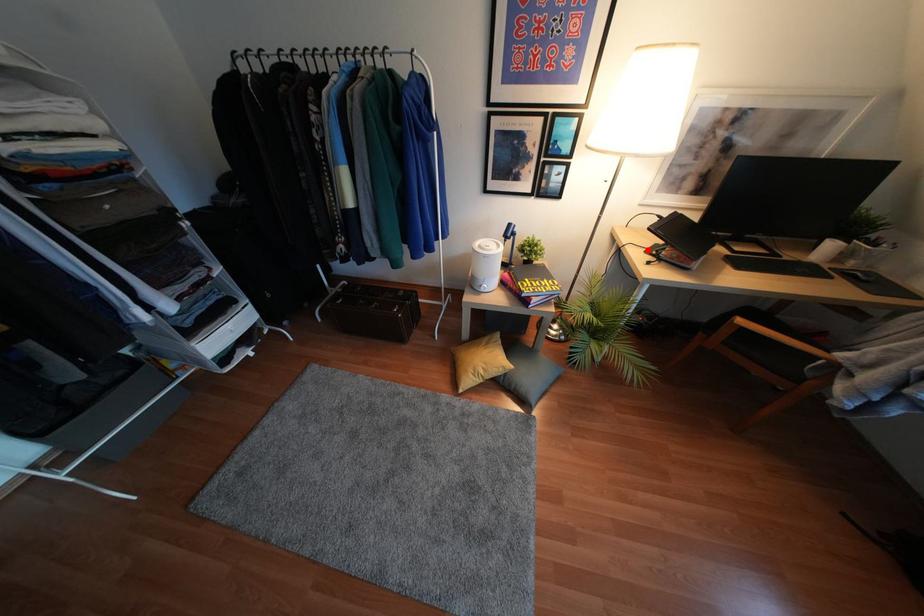
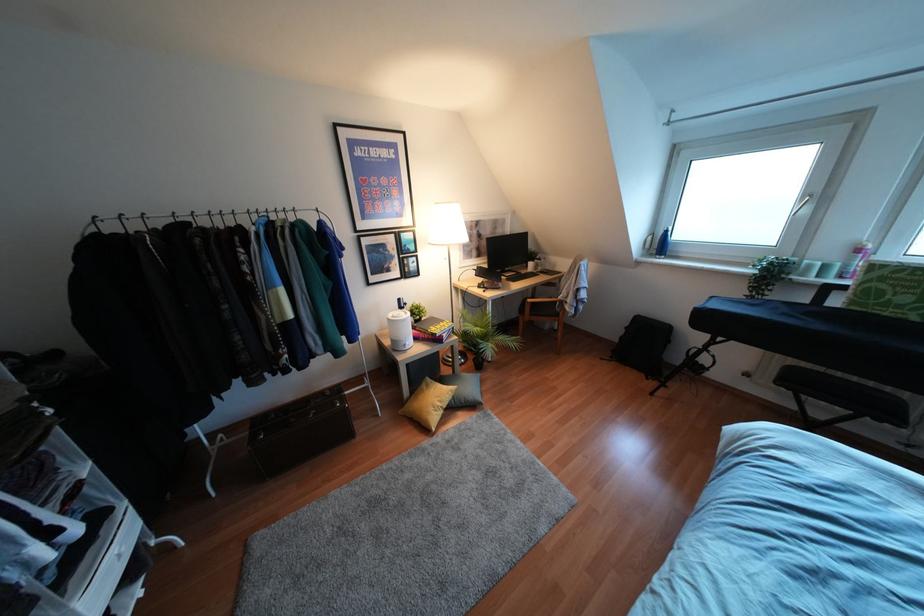
The point at the highlighted location is marked in the first image. Where is the corresponding point in the second image?

(478, 286)